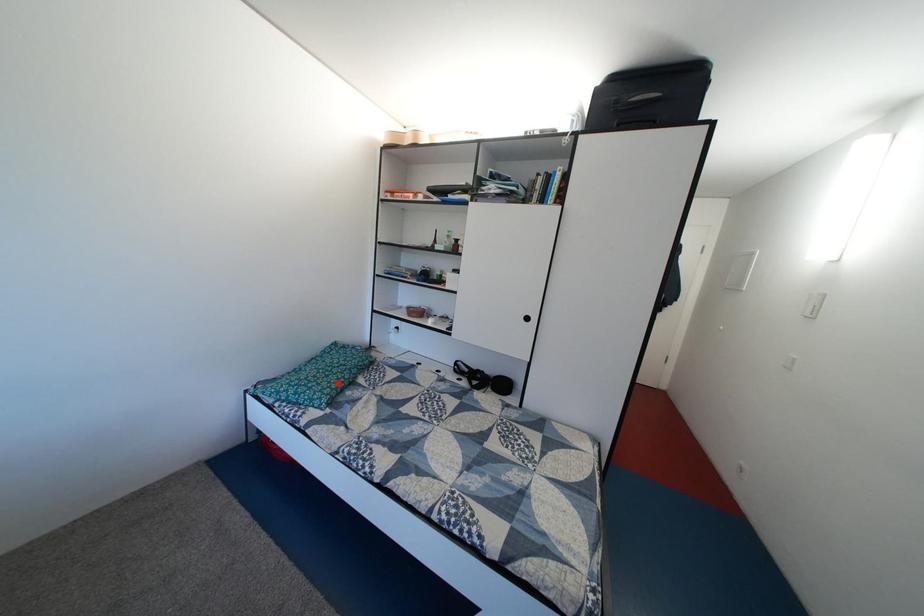
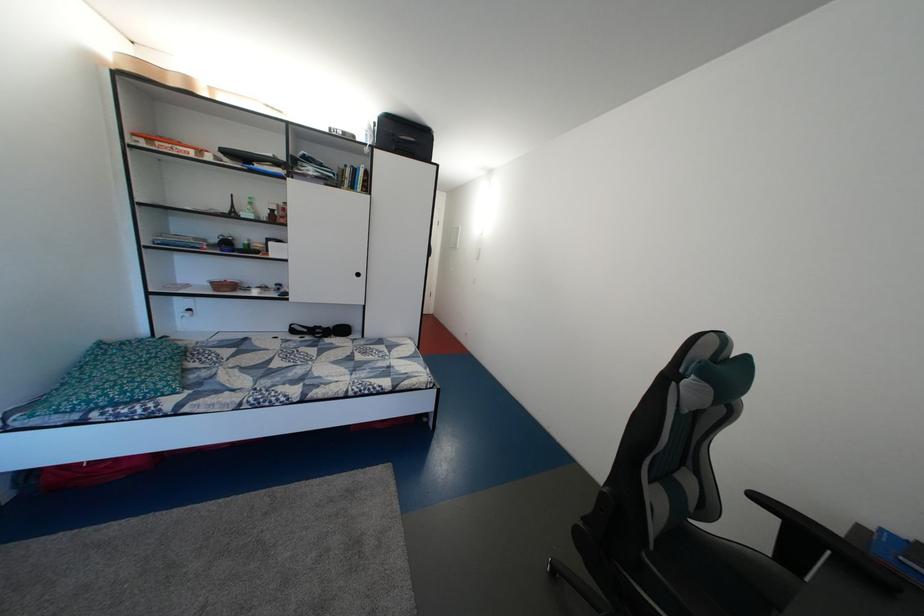
Find the pixel in the second image that matches the highlighted location in the first image.

(160, 376)